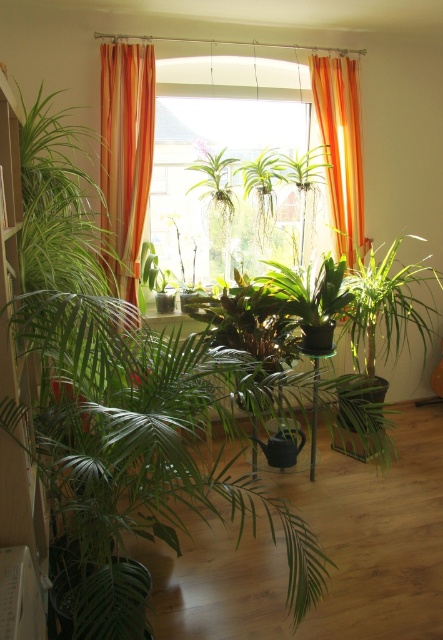
Question: Where is transparent glass window at center located in relation to transparent glass table at center in the image?

Choices:
 (A) right
 (B) left

Answer: (B)

Question: Which point is closer to the camera taking this photo?

Choices:
 (A) (108, 109)
 (B) (208, 182)
 (C) (195, 168)
 (D) (361, 225)

Answer: (A)

Question: Can you confirm if transparent glass window at center is positioned to the right of orange fabric curtain at center?

Choices:
 (A) no
 (B) yes

Answer: (A)

Question: Which point is closer to the camera?

Choices:
 (A) transparent glass window at center
 (B) orange striped curtain at left
 (C) transparent glass table at center
 (D) green leafy plant at center

Answer: (C)

Question: Can you confirm if transparent glass window at center is positioned above orange striped curtain at left?

Choices:
 (A) no
 (B) yes

Answer: (B)

Question: Based on their relative distances, which object is nearer to the transparent glass table at center?

Choices:
 (A) orange fabric curtain at center
 (B) transparent glass window at center
 (C) green leafy plant at center
 (D) orange striped curtain at left

Answer: (A)